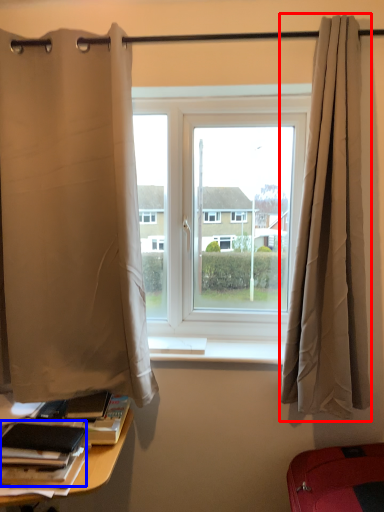
Question: Among these objects, which one is nearest to the camera, curtain (highlighted by a red box) or book (highlighted by a blue box)?

Choices:
 (A) curtain
 (B) book

Answer: (B)